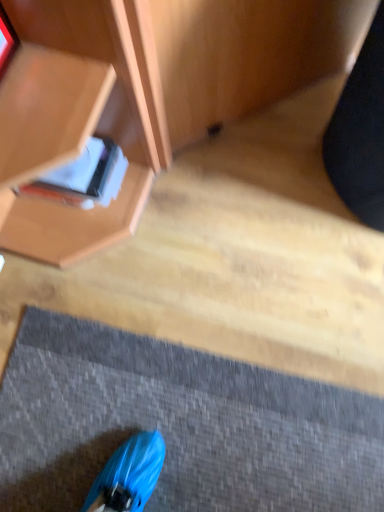
In order to click on free space above matte wood side table at upper left (from a real-world perspective) in this screenshot , I will do `click(202, 290)`.